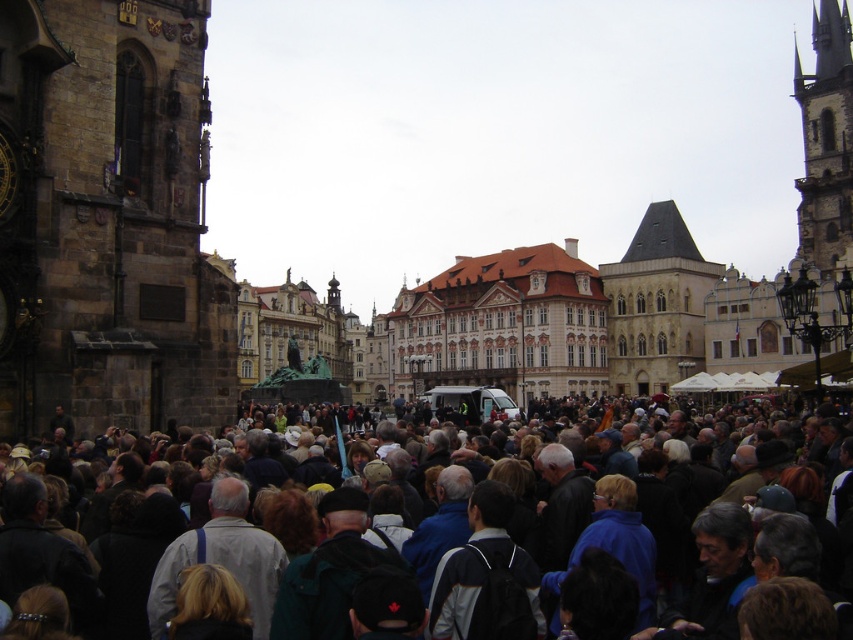
You are a photographer trying to capture the entire scene of the dark gray clothing at center and the stone steeple at right in one shot. Based on their widths, which object should you focus on to ensure both fit in the frame without cropping?

The dark gray clothing at center is wider than the stone steeple at right, so you should focus on the dark gray clothing at center to ensure both fit in the frame without cropping.

You are a tourist standing in the square and want to take a photo that includes both the stone clock tower at left and the stone steeple at right. Which object should you position closer to the camera to ensure both are fully visible in the frame?

Since the stone clock tower at left is shorter than the stone steeple at right, you should position the stone clock tower at left closer to the camera to ensure both are fully visible in the frame.

You are standing in the historical square and want to take a photo. You notice two points of interest marked as point (672, 544) and point (808, 195). Which point is closer to you?

Point (672, 544) is closer to the viewer than point (808, 195).